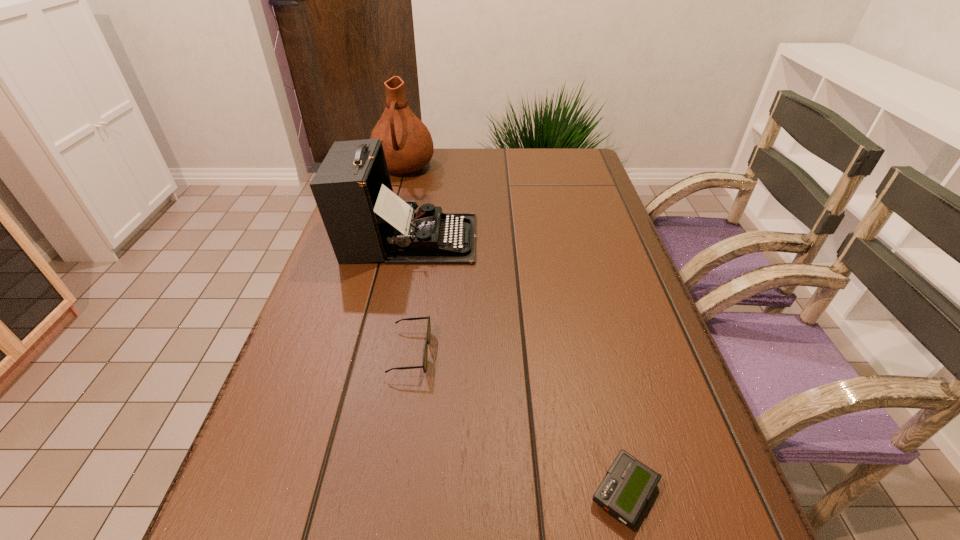
What are the coordinates of `free point between the beeper and the typewriter` in the screenshot? It's located at (516, 366).

At what (x,y) coordinates should I click in order to perform the action: click on blank region between the shortest object and the farthest object. Please return your answer as a coordinate pair (x, y). Looking at the image, I should click on (515, 330).

You are a GUI agent. You are given a task and a screenshot of the screen. Output one action in this format:
    pyautogui.click(x=<x>, y=<y>)
    Task: Click on the free spot between the typewriter and the sunglasses
    The width and height of the screenshot is (960, 540).
    Given the screenshot: What is the action you would take?
    pyautogui.click(x=410, y=295)

I want to click on free space between the sunglasses and the typewriter, so click(410, 295).

Locate an element on the screen. vacant area that lies between the third farthest object and the second farthest object is located at coordinates (410, 295).

Locate an element on the screen. The image size is (960, 540). empty location between the shortest object and the second farthest object is located at coordinates (516, 366).

At what (x,y) coordinates should I click in order to perform the action: click on unoccupied position between the farthest object and the nearest object. Please return your answer as a coordinate pair (x, y). The width and height of the screenshot is (960, 540). Looking at the image, I should click on (515, 330).

Find the location of a particular element. This screenshot has width=960, height=540. free space between the nearest object and the farthest object is located at coordinates (515, 330).

This screenshot has height=540, width=960. I want to click on object that ranks as the third closest to the pitcher, so click(x=628, y=485).

Locate an element on the screen. The height and width of the screenshot is (540, 960). the third closest object relative to the second farthest object is located at coordinates (628, 485).